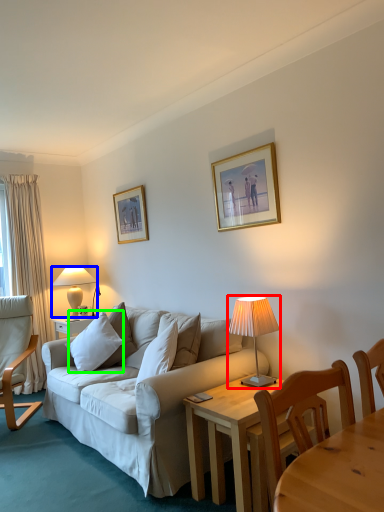
Question: Which is nearer to the lamp (highlighted by a red box)? lamp (highlighted by a blue box) or pillow (highlighted by a green box).

Choices:
 (A) lamp
 (B) pillow

Answer: (B)